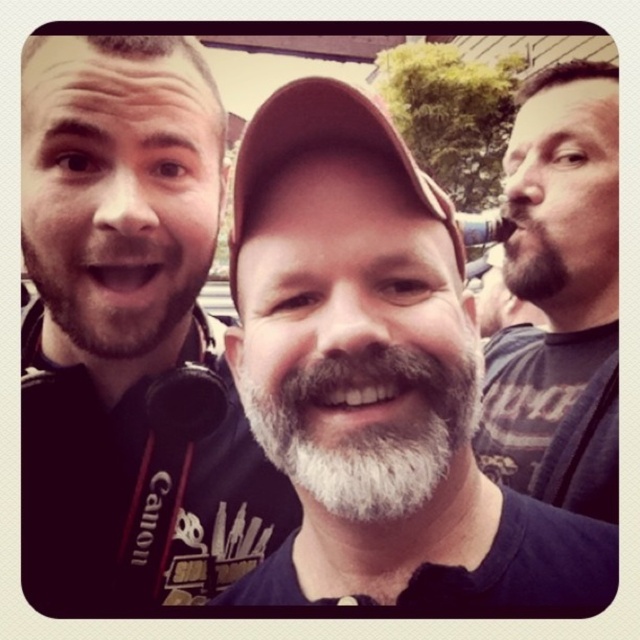
Question: Which of the following is the farthest from the observer?

Choices:
 (A) dark blue t-shirt at right
 (B) dark brown stubble at left
 (C) clear glass beer at center

Answer: (C)

Question: Is gray beard at center bigger than dark blue t-shirt at right?

Choices:
 (A) no
 (B) yes

Answer: (A)

Question: Which point appears farthest from the camera in this image?

Choices:
 (A) (460, 225)
 (B) (106, 113)

Answer: (A)

Question: Does gray beard at center appear on the right side of brown fabric cap at center?

Choices:
 (A) yes
 (B) no

Answer: (A)

Question: Is matte black hoodie at left wider than dark brown stubble at left?

Choices:
 (A) no
 (B) yes

Answer: (B)

Question: Estimate the real-world distances between objects in this image. Which object is farther from the dark brown stubble at left?

Choices:
 (A) brown fabric cap at center
 (B) gray beard at center
 (C) clear glass beer at center

Answer: (C)